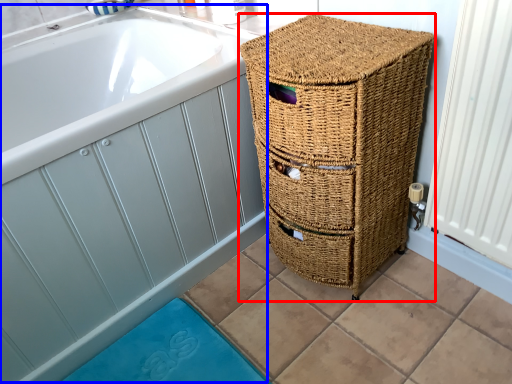
Question: Which of the following is the farthest to the observer, furniture (highlighted by a red box) or bath (highlighted by a blue box)?

Choices:
 (A) furniture
 (B) bath

Answer: (A)